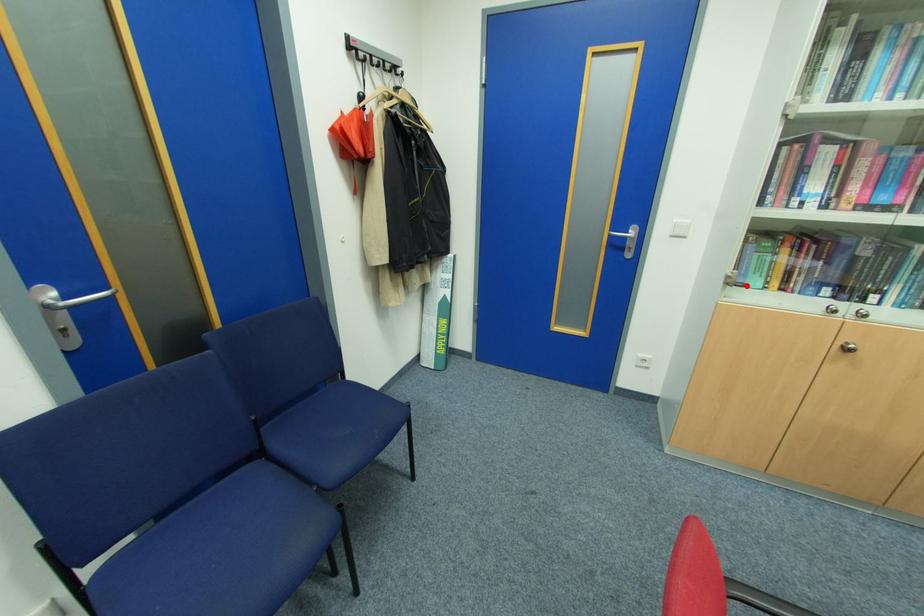
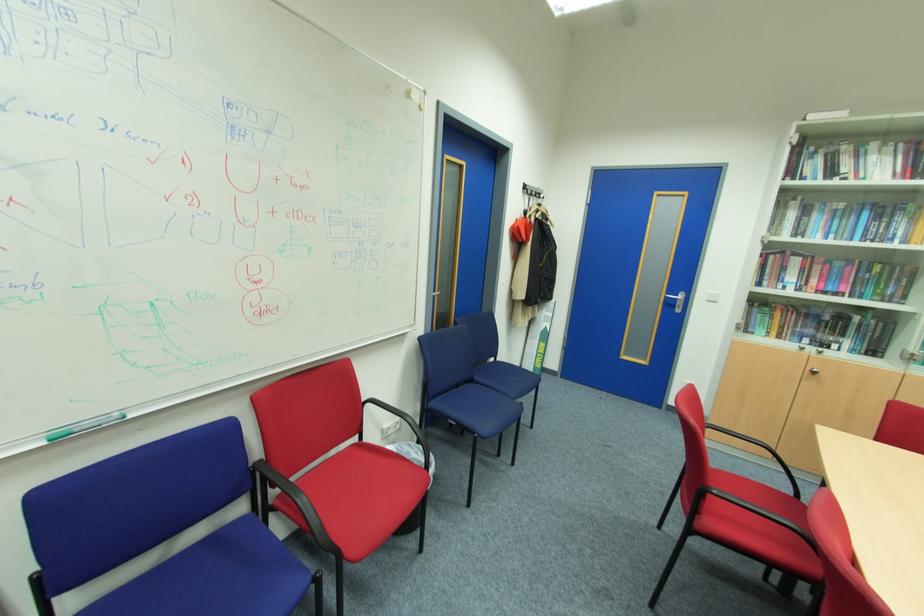
In the second image, find the point that corresponds to the highlighted location in the first image.

(756, 334)